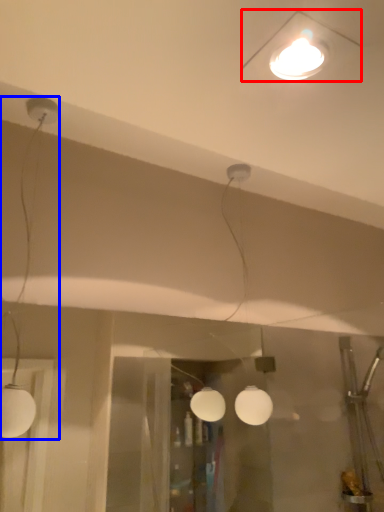
Question: Which of the following is the farthest to the observer, lamp (highlighted by a red box) or lamp (highlighted by a blue box)?

Choices:
 (A) lamp
 (B) lamp

Answer: (B)